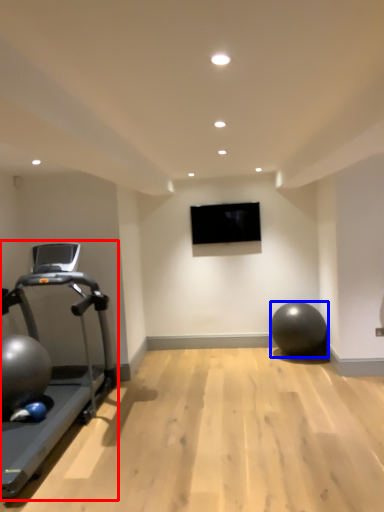
Question: Which of the following is the farthest to the observer, treadmill (highlighted by a red box) or ball (highlighted by a blue box)?

Choices:
 (A) treadmill
 (B) ball

Answer: (B)